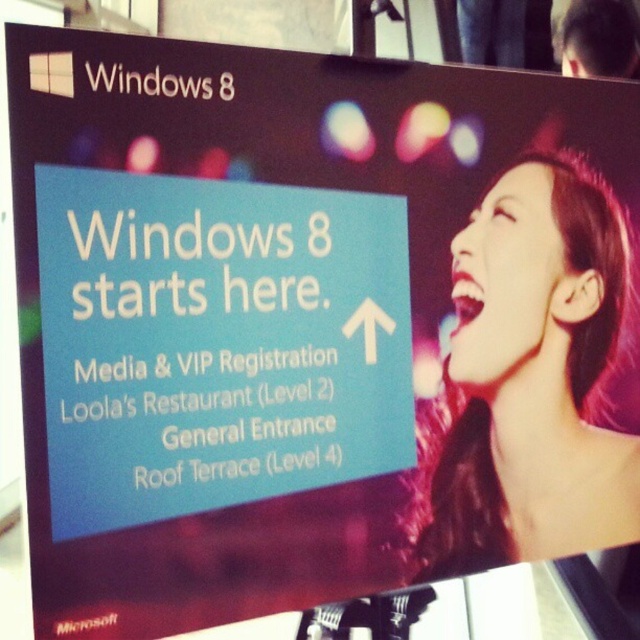
Question: Considering the relative positions of blue paper sign at center and shiny hair at upper right in the image provided, where is blue paper sign at center located with respect to shiny hair at upper right?

Choices:
 (A) right
 (B) left

Answer: (B)

Question: Which of the following is the farthest from the observer?

Choices:
 (A) (458, 269)
 (B) (412, 452)

Answer: (A)

Question: Which point is farther from the camera taking this photo?

Choices:
 (A) (280, 481)
 (B) (600, 259)

Answer: (B)

Question: Which point is farther from the camera taking this photo?

Choices:
 (A) (547, 384)
 (B) (77, 500)

Answer: (A)

Question: Is blue paper sign at center closer to camera compared to shiny hair at upper right?

Choices:
 (A) no
 (B) yes

Answer: (B)

Question: Is blue paper sign at center behind shiny hair at upper right?

Choices:
 (A) no
 (B) yes

Answer: (A)